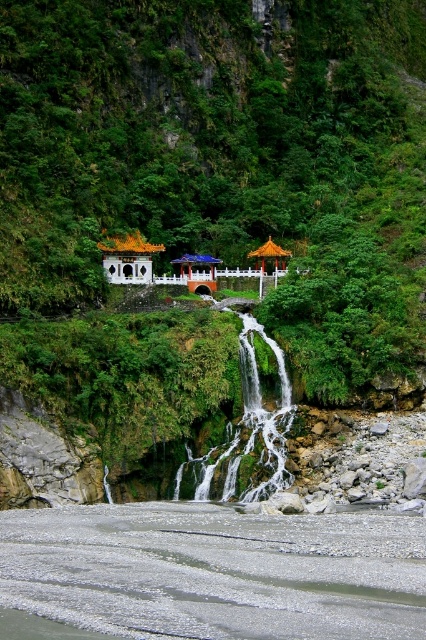
You are standing at the center of the image and want to locate the white glossy gazebo at left. Based on its coordinates, in which direction should you look to find it?

The white glossy gazebo at left is located at coordinates point (127,257), so you should look to your left side to find it.

You are a tourist standing at the edge of the river and want to take a photo of both the green mossy waterfall at center and the matte orange gazebo at center. Which object should you position closer to the camera to ensure both are in focus?

To ensure both the green mossy waterfall at center and the matte orange gazebo at center are in focus, you should position the green mossy waterfall at center closer to the camera since it is in front of the matte orange gazebo at center.